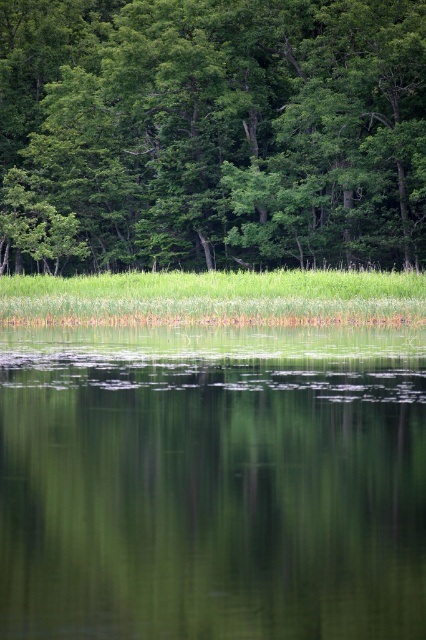
Question: Which point is closer to the camera?

Choices:
 (A) (215, 566)
 (B) (261, 35)

Answer: (A)

Question: Can you confirm if green reflective water at center is positioned to the right of green leafy trees at upper center?

Choices:
 (A) no
 (B) yes

Answer: (B)

Question: Which point is farther to the camera?

Choices:
 (A) (226, 273)
 (B) (279, 632)

Answer: (A)

Question: Can you confirm if green leafy trees at upper center is bigger than green grass at center?

Choices:
 (A) yes
 (B) no

Answer: (A)

Question: Considering the relative positions of green leafy trees at upper center and green grass at center in the image provided, where is green leafy trees at upper center located with respect to green grass at center?

Choices:
 (A) right
 (B) left

Answer: (B)

Question: Considering the real-world distances, which object is farthest from the green reflective water at center?

Choices:
 (A) green leafy trees at upper center
 (B) green grass at center

Answer: (A)